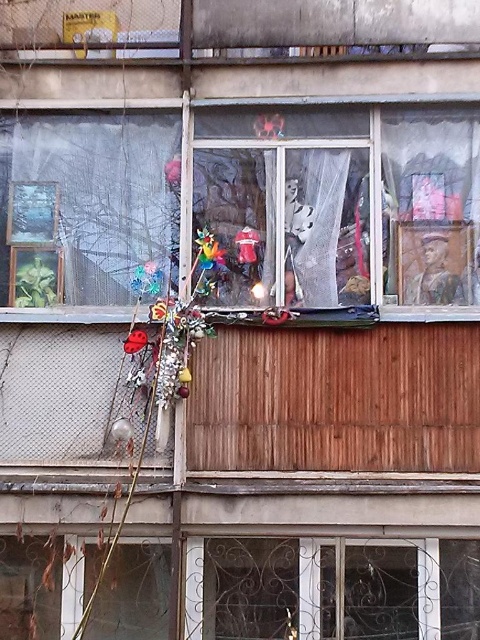
Question: Does transparent plastic window at upper left come behind shiny red toy at center?

Choices:
 (A) yes
 (B) no

Answer: (B)

Question: Which point is farther from the camera taking this photo?

Choices:
 (A) (254, 230)
 (B) (22, 204)
 (C) (441, 252)

Answer: (B)

Question: Which object is the closest to the transparent plastic window at center?

Choices:
 (A) transparent plastic window at upper left
 (B) shiny red toy at center

Answer: (A)

Question: Is transparent plastic window at center to the left of transparent plastic window at upper left from the viewer's perspective?

Choices:
 (A) no
 (B) yes

Answer: (A)

Question: Which object is positioned closest to the shiny red toy at center?

Choices:
 (A) transparent plastic window at center
 (B) transparent plastic window at upper left

Answer: (A)

Question: Does transparent plastic window at center have a larger size compared to transparent plastic window at upper left?

Choices:
 (A) yes
 (B) no

Answer: (A)